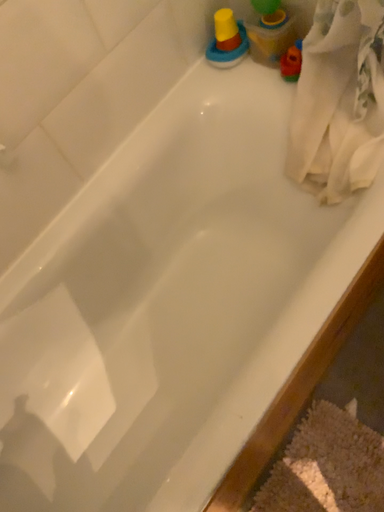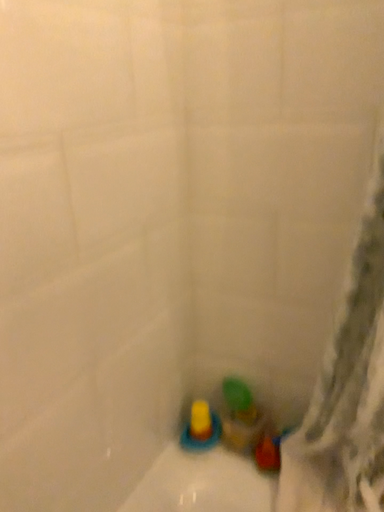
Question: How did the camera likely rotate when shooting the video?

Choices:
 (A) rotated upward
 (B) rotated downward

Answer: (A)